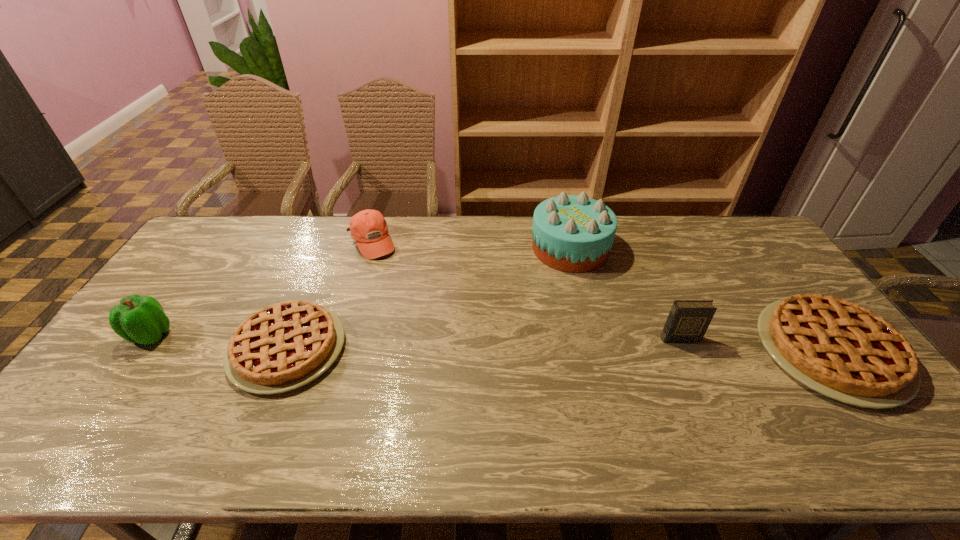
Find the location of `empty space that is in between the baseball cap and the diary`. empty space that is in between the baseball cap and the diary is located at coordinates (525, 291).

Where is `free spot between the shortest object and the baseball cap`? free spot between the shortest object and the baseball cap is located at coordinates (329, 295).

Identify the location of vacant space that is in between the rightmost object and the baseball cap. (601, 297).

Locate which object is the fifth closest to the second object from right to left. Please provide its 2D coordinates. Your answer should be formatted as a tuple, i.e. [(x, y)], where the tuple contains the x and y coordinates of a point satisfying the conditions above.

[(139, 319)]

Identify which object is the nearest to the shortest object. Please provide its 2D coordinates. Your answer should be formatted as a tuple, i.e. [(x, y)], where the tuple contains the x and y coordinates of a point satisfying the conditions above.

[(139, 319)]

The height and width of the screenshot is (540, 960). In order to click on blank area in the image that satisfies the following two spatial constraints: 1. on the back side of the shorter pie; 2. on the left side of the baseball cap in this screenshot , I will do `click(331, 242)`.